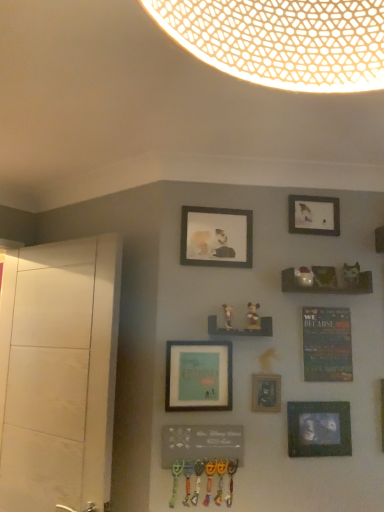
Question: In which direction should I rotate to look at matte black picture frame at center, which ranks as the 4th picture frame in top-to-bottom order?

Choices:
 (A) right
 (B) left

Answer: (A)

Question: From a real-world perspective, is matte black picture frame at center, which ranks as the 4th picture frame in top-to-bottom order, beneath matte wooden picture frame at upper center, which ranks as the 4th picture frame in bottom-to-top order?

Choices:
 (A) yes
 (B) no

Answer: (A)

Question: From a real-world perspective, is matte black picture frame at center, which ranks as the 4th picture frame in top-to-bottom order, over matte wooden picture frame at upper center, the 2th picture frame in the top-to-bottom sequence?

Choices:
 (A) no
 (B) yes

Answer: (A)

Question: Considering the relative sizes of matte black picture frame at center, arranged as the second picture frame when ordered from the bottom, and matte wooden picture frame at upper center, which ranks as the 4th picture frame in bottom-to-top order, in the image provided, is matte black picture frame at center, arranged as the second picture frame when ordered from the bottom, shorter than matte wooden picture frame at upper center, which ranks as the 4th picture frame in bottom-to-top order,?

Choices:
 (A) no
 (B) yes

Answer: (B)

Question: From the image's perspective, is matte black picture frame at center, arranged as the second picture frame when ordered from the bottom, on matte wooden picture frame at upper center, the 2th picture frame in the top-to-bottom sequence?

Choices:
 (A) yes
 (B) no

Answer: (B)

Question: Is there a large distance between matte black picture frame at center, which ranks as the 4th picture frame in top-to-bottom order, and matte wooden picture frame at upper center, the 2th picture frame in the top-to-bottom sequence?

Choices:
 (A) yes
 (B) no

Answer: (B)

Question: Does matte black picture frame at center, arranged as the second picture frame when ordered from the bottom, turn towards matte wooden picture frame at upper center, the 2th picture frame in the top-to-bottom sequence?

Choices:
 (A) yes
 (B) no

Answer: (B)

Question: Does matte brown figurine at center-right, arranged as the second art when viewed from the left, lie in front of matte black picture frame at center, arranged as the second picture frame when ordered from the bottom?

Choices:
 (A) yes
 (B) no

Answer: (A)

Question: Is matte black picture frame at center, which ranks as the 4th picture frame in top-to-bottom order, a part of matte brown figurine at center-right, arranged as the second art when viewed from the left?

Choices:
 (A) yes
 (B) no

Answer: (B)

Question: Is matte brown figurine at center-right, arranged as the second art when viewed from the left, bigger than matte black picture frame at center, arranged as the second picture frame when ordered from the bottom?

Choices:
 (A) yes
 (B) no

Answer: (B)

Question: From the image's perspective, would you say matte brown figurine at center-right, which is the second art from right to left, is positioned over matte black picture frame at center, which ranks as the 4th picture frame in top-to-bottom order?

Choices:
 (A) no
 (B) yes

Answer: (B)

Question: From the image's perspective, does matte brown figurine at center-right, which is the second art from right to left, appear lower than matte black picture frame at center, arranged as the second picture frame when ordered from the bottom?

Choices:
 (A) no
 (B) yes

Answer: (A)

Question: From a real-world perspective, is matte brown figurine at center-right, which is the second art from right to left, beneath matte black picture frame at center, which ranks as the 4th picture frame in top-to-bottom order?

Choices:
 (A) yes
 (B) no

Answer: (B)

Question: Is there a large distance between wooden mickey mouse figurine at center, the 3th art when ordered from right to left, and matte brown figurine at center-right, arranged as the second art when viewed from the left?

Choices:
 (A) yes
 (B) no

Answer: (B)